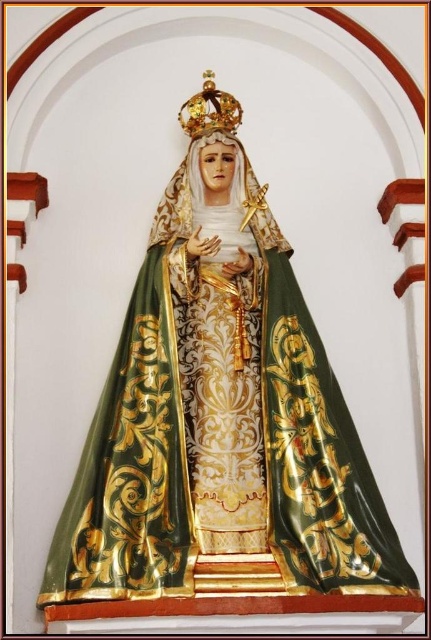
Question: Which point is farther to the camera?

Choices:
 (A) green satin cape at center
 (B) gold shiny crown at upper center

Answer: (B)

Question: From the image, what is the correct spatial relationship of green satin cape at center in relation to gold shiny crown at upper center?

Choices:
 (A) above
 (B) below

Answer: (B)

Question: Does green satin cape at center appear over gold shiny crown at upper center?

Choices:
 (A) yes
 (B) no

Answer: (B)

Question: Which object appears farthest from the camera in this image?

Choices:
 (A) green satin cape at center
 (B) gold shiny crown at upper center

Answer: (B)

Question: Does green satin cape at center have a greater width compared to gold shiny crown at upper center?

Choices:
 (A) no
 (B) yes

Answer: (B)